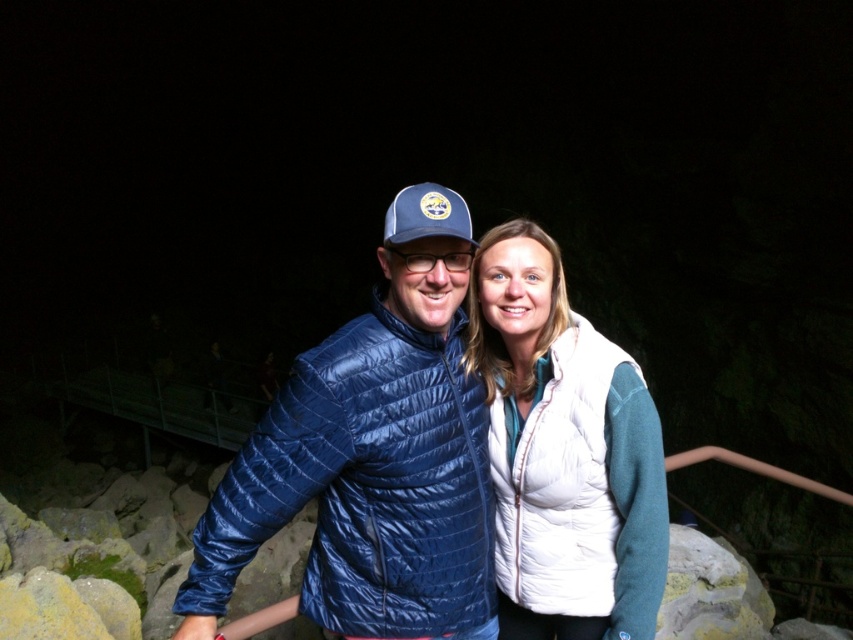
You are a photographer setting up a tripod to capture the two people in the scene. The matte blue puffer jacket at center and the white down vest at center are both at the center. Since you want to ensure both are in focus, which one should you adjust the camera focus to prioritize based on their positions?

The matte blue puffer jacket at center has a lesser height compared to white down vest at center, so you should prioritize focusing on the white down vest at center as it is taller and might be further away, ensuring both are in focus.

Consider the image. You are a photographer trying to capture a photo of the matte blue puffer jacket at center and the white down vest at center. Which of the two is located to the left in the image?

The matte blue puffer jacket at center is positioned on the left side of the white down vest at center, so it is the one located to the left in the image.

You are a photographer trying to capture a closeup of the white down vest at center. You notice a point marked at coordinates (x=564, y=452). Where is this point located in relation to the white down vest at center?

The point at (x=564, y=452) is located on the white down vest at center.